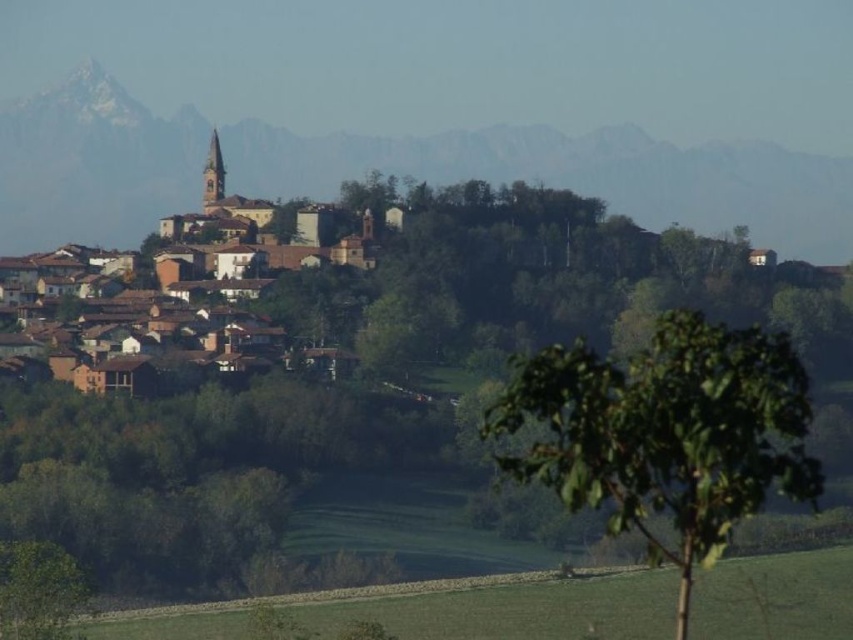
You are a drone operator tasked with capturing aerial footage of the village. The brown clay houses at center are your primary focus. Based on their coordinates, which direction should you adjust your drone to ensure they remain centered in the frame?

The brown clay houses at center are already positioned at coordinates point (x=251, y=241), so they are already centered in the frame.

You are an artist planning to paint the snowy rocky mountain at upper center and the green leafy tree at center. Based on their positions, which object should you paint first to create a sense of depth in your painting?

The snowy rocky mountain at upper center should be painted first as it is further away from the viewer compared to the green leafy tree at center, allowing you to layer the tree on top to create depth.

You are a photographer standing at the base of the hill, looking up at the village. You want to capture a photo that includes both the bell tower and the greenery in the foreground. Which of the two points, point (149, 202) or point (346, 257), is closer to your camera position?

Point (149, 202) is further to the camera than point (346, 257), so the point closer to your camera is point (346, 257).